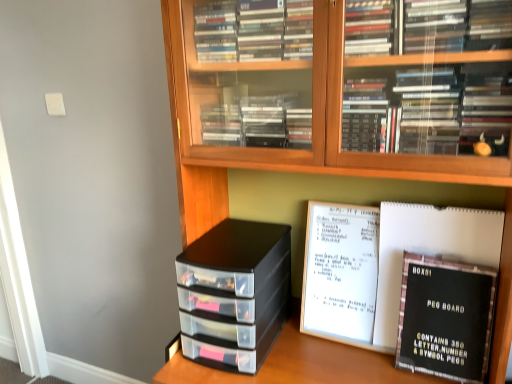
Question: Considering the relative sizes of black cardboard peg board at lower right and black plastic storage drawers at center in the image provided, is black cardboard peg board at lower right smaller than black plastic storage drawers at center?

Choices:
 (A) no
 (B) yes

Answer: (B)

Question: Does black cardboard peg board at lower right appear on the left side of black plastic storage drawers at center?

Choices:
 (A) yes
 (B) no

Answer: (B)

Question: Would you consider black cardboard peg board at lower right to be distant from black plastic storage drawers at center?

Choices:
 (A) no
 (B) yes

Answer: (A)

Question: From a real-world perspective, is black cardboard peg board at lower right on top of black plastic storage drawers at center?

Choices:
 (A) yes
 (B) no

Answer: (B)

Question: Can you confirm if black cardboard peg board at lower right is thinner than black plastic storage drawers at center?

Choices:
 (A) no
 (B) yes

Answer: (B)

Question: From the image's perspective, does black cardboard peg board at lower right appear higher than black plastic storage drawers at center?

Choices:
 (A) yes
 (B) no

Answer: (B)

Question: Is black plastic storage drawers at center far away from black cardboard peg board at lower right?

Choices:
 (A) yes
 (B) no

Answer: (B)

Question: Can you confirm if black plastic storage drawers at center is thinner than black cardboard peg board at lower right?

Choices:
 (A) no
 (B) yes

Answer: (A)

Question: Is black plastic storage drawers at center directly adjacent to black cardboard peg board at lower right?

Choices:
 (A) yes
 (B) no

Answer: (B)

Question: From the image's perspective, would you say black plastic storage drawers at center is shown under black cardboard peg board at lower right?

Choices:
 (A) yes
 (B) no

Answer: (B)

Question: Is black plastic storage drawers at center behind black cardboard peg board at lower right?

Choices:
 (A) no
 (B) yes

Answer: (B)

Question: Can you confirm if black plastic storage drawers at center is smaller than black cardboard peg board at lower right?

Choices:
 (A) no
 (B) yes

Answer: (A)

Question: Is black cardboard peg board at lower right directly adjacent to wooden bookcase at center?

Choices:
 (A) no
 (B) yes

Answer: (A)